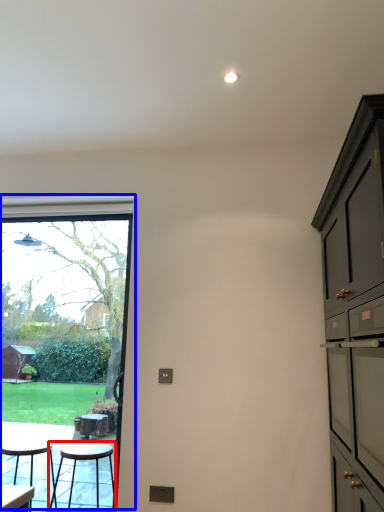
Question: Which point is closer to the camera, stool (highlighted by a red box) or window (highlighted by a blue box)?

Choices:
 (A) stool
 (B) window

Answer: (A)